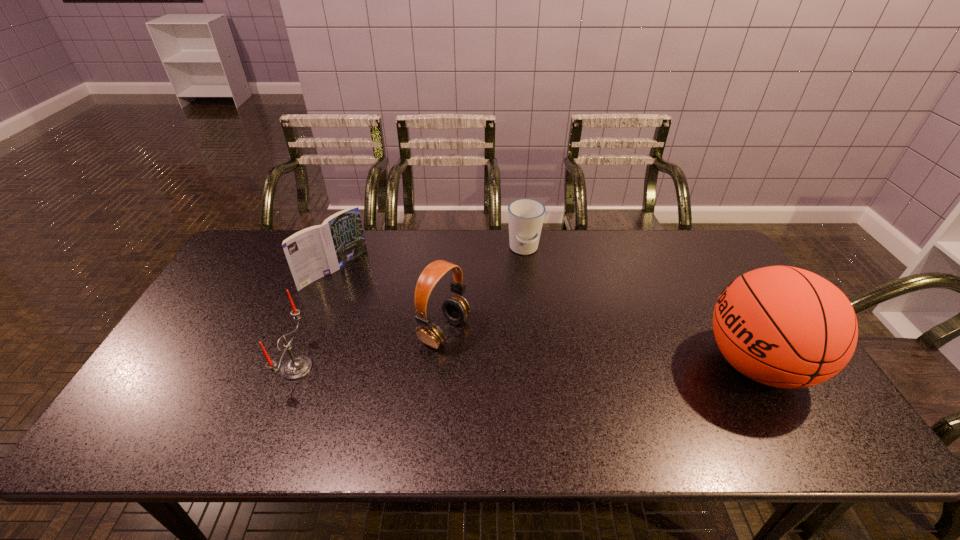
What are the coordinates of `empty location between the candle and the book` in the screenshot? It's located at (316, 319).

Identify the location of vacant region between the tallest object and the cup. (640, 307).

Locate which object is the third closest to the book. Please provide its 2D coordinates. Your answer should be formatted as a tuple, i.e. [(x, y)], where the tuple contains the x and y coordinates of a point satisfying the conditions above.

[(525, 216)]

I want to click on object that is the closest to the candle, so click(314, 252).

This screenshot has height=540, width=960. Find the location of `free space that satisfies the following two spatial constraints: 1. on the front side of the rightmost object; 2. on the side with logo of the book`. free space that satisfies the following two spatial constraints: 1. on the front side of the rightmost object; 2. on the side with logo of the book is located at coordinates (299, 364).

Locate an element on the screen. Image resolution: width=960 pixels, height=540 pixels. free space in the image that satisfies the following two spatial constraints: 1. on the back side of the book; 2. on the right side of the cup is located at coordinates (343, 249).